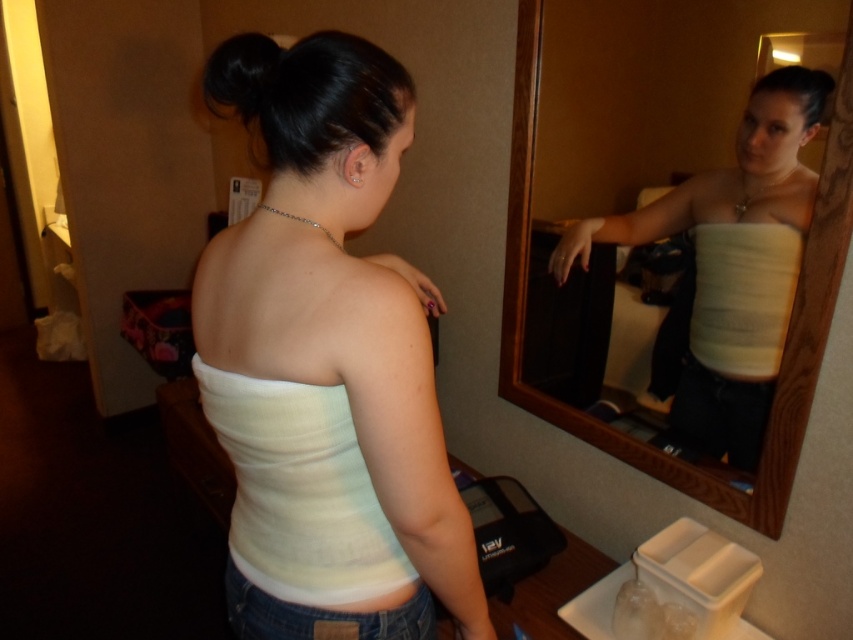
Based on the photo, you are a fashion designer observing a model wearing two white tops. The model is adjusting her arm while looking in the mirror. Which top, the white matte tank top at center or the white fabric strapless top at upper center, is located to the left of the other?

The white matte tank top at center is positioned on the left side of the white fabric strapless top at upper center.

You are standing in the room and see two points marked in the image. Which point is closer to you, point (519, 74) or point (251, 45)?

Point (251, 45) is closer to you because it is in front of point (519, 74).

You are a fashion designer observing the woman in the scene. You need to ensure that the white matte tank top at center and the black shiny hair at upper center are positioned correctly for a photo shoot. Based on their distance, can you confirm if they are within the recommended 15 inches proximity for a flattering composition?

The white matte tank top at center is 14.33 inches away from the black shiny hair at upper center, which is within the recommended 15 inches proximity for a flattering composition.